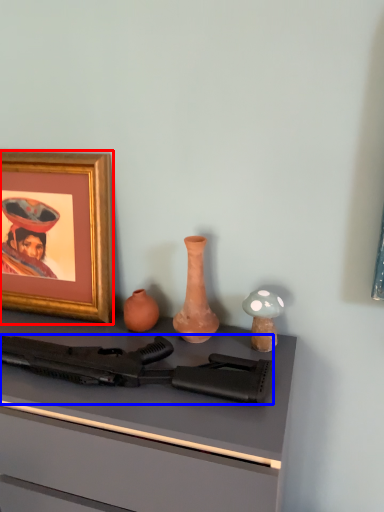
Question: Which object appears closest to the camera in this image, picture frame (highlighted by a red box) or rifle (highlighted by a blue box)?

Choices:
 (A) picture frame
 (B) rifle

Answer: (B)